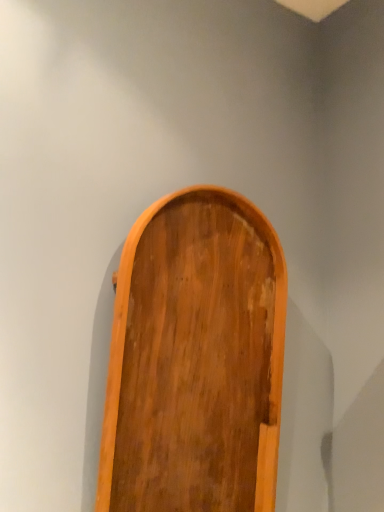
Find the location of `wooden door at center`. wooden door at center is located at coordinates pos(195,359).

Describe the element at coordinates (195, 359) in the screenshot. I see `wooden door at center` at that location.

The width and height of the screenshot is (384, 512). What are the coordinates of `wooden door at center` in the screenshot? It's located at (195, 359).